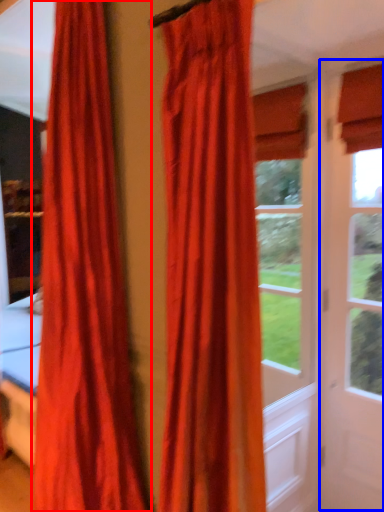
Question: Which object appears closest to the camera in this image, curtain (highlighted by a red box) or screen door (highlighted by a blue box)?

Choices:
 (A) curtain
 (B) screen door

Answer: (A)